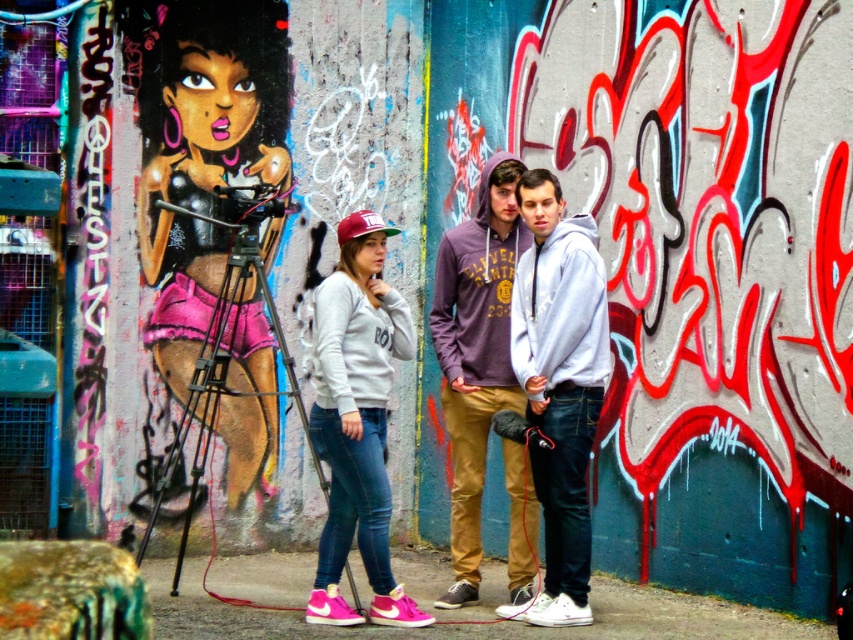
Between light gray hoodie at center and matte purple hoodie at center, which one is positioned higher?

matte purple hoodie at center

Does light gray hoodie at center lie behind matte purple hoodie at center?

That is False.

Which is behind, point (584, 388) or point (503, 326)?

Positioned behind is point (503, 326).

Where is `light gray hoodie at center`? light gray hoodie at center is located at coordinates (560, 381).

Is matte purple hoodie at center to the right of white fleece hoodie at center from the viewer's perspective?

No, matte purple hoodie at center is not to the right of white fleece hoodie at center.

Is matte purple hoodie at center taller than white fleece hoodie at center?

Yes, matte purple hoodie at center is taller than white fleece hoodie at center.

Who is more distant from viewer, (479, 321) or (521, 364)?

Point (479, 321)

At what (x,y) coordinates should I click in order to perform the action: click on matte purple hoodie at center. Please return your answer as a coordinate pair (x, y). The width and height of the screenshot is (853, 640). Looking at the image, I should click on (474, 352).

Looking at this image, between light gray hoodie at center and matte gray hoodie at center, which one has less height?

With less height is matte gray hoodie at center.

Which is more to the right, light gray hoodie at center or matte gray hoodie at center?

light gray hoodie at center is more to the right.

Looking at this image, who is more forward, (587, 449) or (380, 378)?

Point (587, 449) is in front.

Locate an element on the screen. light gray hoodie at center is located at coordinates (560, 381).